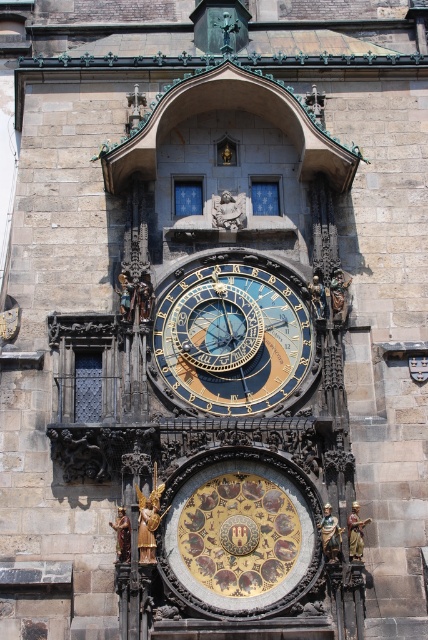
Question: Which object is the farthest from the gold metallic statue at center?

Choices:
 (A) matte gold statue at center
 (B) gold metallic angel at lower left
 (C) gold polished statue at center
 (D) gold metallic statue at lower right

Answer: (A)

Question: Which of these objects is positioned farthest from the matte gold statue at center?

Choices:
 (A) gold metallic statue at center
 (B) gold metallic statue at lower right
 (C) gold metallic statue at center-right
 (D) gold polished statue at center

Answer: (B)

Question: Does gold polished statue at center appear over gold metallic statue at center-right?

Choices:
 (A) yes
 (B) no

Answer: (B)

Question: Is gold metallic clock at center wider than gold metallic statue at center?

Choices:
 (A) no
 (B) yes

Answer: (B)

Question: Does gold metallic statue at lower right come behind gold metallic statue at center-right?

Choices:
 (A) no
 (B) yes

Answer: (A)

Question: Which point appears closest to the camera in this image?

Choices:
 (A) (323, 534)
 (B) (354, 540)
 (C) (333, 292)

Answer: (B)